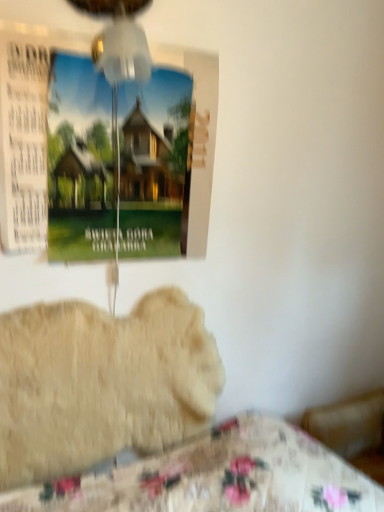
Question: Which direction should I rotate to look at transparent plastic mechanical fan at upper center?

Choices:
 (A) right
 (B) left

Answer: (B)

Question: Can we say transparent plastic mechanical fan at upper center lies outside fluffy beige dog at lower left?

Choices:
 (A) yes
 (B) no

Answer: (A)

Question: Considering the relative sizes of transparent plastic mechanical fan at upper center and fluffy beige dog at lower left in the image provided, is transparent plastic mechanical fan at upper center shorter than fluffy beige dog at lower left?

Choices:
 (A) no
 (B) yes

Answer: (B)

Question: Is there a large distance between transparent plastic mechanical fan at upper center and fluffy beige dog at lower left?

Choices:
 (A) yes
 (B) no

Answer: (B)

Question: Is transparent plastic mechanical fan at upper center to the left of fluffy beige dog at lower left from the viewer's perspective?

Choices:
 (A) no
 (B) yes

Answer: (A)

Question: From the image's perspective, is transparent plastic mechanical fan at upper center beneath fluffy beige dog at lower left?

Choices:
 (A) no
 (B) yes

Answer: (A)

Question: Is transparent plastic mechanical fan at upper center smaller than fluffy beige dog at lower left?

Choices:
 (A) yes
 (B) no

Answer: (A)

Question: Is transparent plastic mechanical fan at upper center in front of matte paper poster at upper left?

Choices:
 (A) yes
 (B) no

Answer: (A)

Question: From the image's perspective, is transparent plastic mechanical fan at upper center located above matte paper poster at upper left?

Choices:
 (A) no
 (B) yes

Answer: (B)

Question: Is transparent plastic mechanical fan at upper center at the left side of matte paper poster at upper left?

Choices:
 (A) yes
 (B) no

Answer: (B)

Question: From a real-world perspective, is transparent plastic mechanical fan at upper center physically above matte paper poster at upper left?

Choices:
 (A) no
 (B) yes

Answer: (B)

Question: Is transparent plastic mechanical fan at upper center not within matte paper poster at upper left?

Choices:
 (A) yes
 (B) no

Answer: (A)

Question: Can you confirm if transparent plastic mechanical fan at upper center is shorter than matte paper poster at upper left?

Choices:
 (A) no
 (B) yes

Answer: (B)

Question: Considering the relative sizes of fluffy beige dog at lower left and matte paper poster at upper left in the image provided, is fluffy beige dog at lower left bigger than matte paper poster at upper left?

Choices:
 (A) yes
 (B) no

Answer: (A)